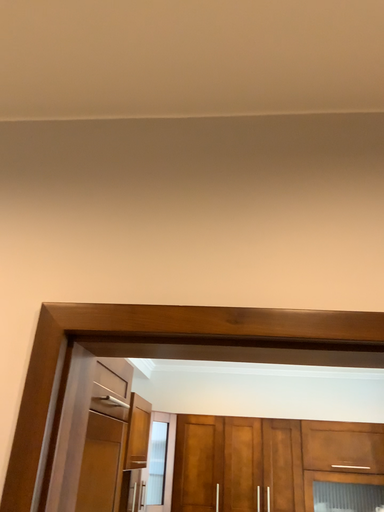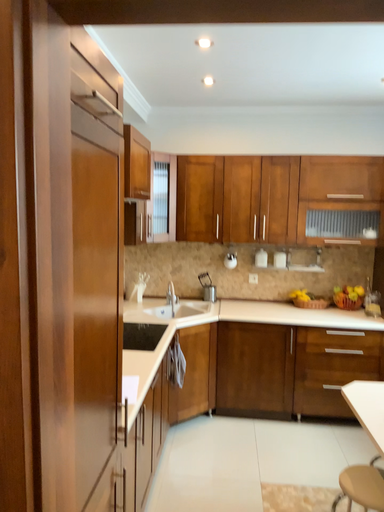
Question: How did the camera likely rotate when shooting the video?

Choices:
 (A) rotated upward
 (B) rotated downward

Answer: (B)